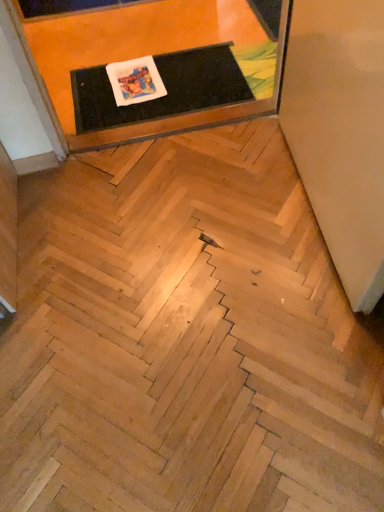
The width and height of the screenshot is (384, 512). Describe the element at coordinates (151, 121) in the screenshot. I see `matte black mat at upper center` at that location.

In order to click on matte black mat at upper center in this screenshot , I will do `click(151, 121)`.

Measure the distance between point (273, 95) and camera.

The depth of point (273, 95) is 5.57 feet.

Describe the element at coordinates (165, 87) in the screenshot. I see `black rubber mat at upper center` at that location.

Identify the location of black rubber mat at upper center. This screenshot has height=512, width=384. (165, 87).

This screenshot has width=384, height=512. Find the location of `matte black mat at upper center`. matte black mat at upper center is located at coordinates (151, 121).

Is black rubber mat at upper center to the left of matte black mat at upper center from the viewer's perspective?

In fact, black rubber mat at upper center is to the right of matte black mat at upper center.

Which object is further away from the camera, black rubber mat at upper center or matte black mat at upper center?

black rubber mat at upper center is further away from the camera.

Does point (99, 98) lie behind point (18, 47)?

Yes, it is.

From the image's perspective, is black rubber mat at upper center located above or below matte black mat at upper center?

black rubber mat at upper center is situated lower than matte black mat at upper center in the image.

From a real-world perspective, is black rubber mat at upper center located higher than matte black mat at upper center?

No, from a real-world perspective, black rubber mat at upper center is not over matte black mat at upper center

Is black rubber mat at upper center wider than matte black mat at upper center?

In fact, black rubber mat at upper center might be narrower than matte black mat at upper center.

Considering the relative sizes of black rubber mat at upper center and matte black mat at upper center in the image provided, is black rubber mat at upper center taller than matte black mat at upper center?

No, black rubber mat at upper center is not taller than matte black mat at upper center.

Is black rubber mat at upper center bigger or smaller than matte black mat at upper center?

Considering their sizes, black rubber mat at upper center takes up less space than matte black mat at upper center.

Would you say black rubber mat at upper center contains matte black mat at upper center?

No, matte black mat at upper center is not inside black rubber mat at upper center.

Are black rubber mat at upper center and matte black mat at upper center located far from each other?

No.

Is black rubber mat at upper center aimed at matte black mat at upper center?

Yes, black rubber mat at upper center is oriented towards matte black mat at upper center.

Image resolution: width=384 pixels, height=512 pixels. Identify the location of table below the matte black mat at upper center (from the image's perspective). (165, 87).

Can you confirm if matte black mat at upper center is positioned to the left of black rubber mat at upper center?

Yes.

Considering their positions, is matte black mat at upper center located in front of or behind black rubber mat at upper center?

Clearly, matte black mat at upper center is in front of black rubber mat at upper center.

Is point (40, 96) positioned in front of point (230, 64)?

Yes.

From the image's perspective, which one is positioned higher, matte black mat at upper center or black rubber mat at upper center?

matte black mat at upper center appears higher in the image.

From a real-world perspective, is matte black mat at upper center located higher than black rubber mat at upper center?

Yes, from a real-world perspective, matte black mat at upper center is above black rubber mat at upper center.

Considering the relative sizes of matte black mat at upper center and black rubber mat at upper center in the image provided, is matte black mat at upper center thinner than black rubber mat at upper center?

No, matte black mat at upper center is not thinner than black rubber mat at upper center.

Looking at this image, which of these two, matte black mat at upper center or black rubber mat at upper center, stands shorter?

black rubber mat at upper center is shorter.

Who is smaller, matte black mat at upper center or black rubber mat at upper center?

With smaller size is black rubber mat at upper center.

Is black rubber mat at upper center completely or partially inside matte black mat at upper center?

Yes, matte black mat at upper center is surrounding black rubber mat at upper center.

Are matte black mat at upper center and black rubber mat at upper center making contact?

No, matte black mat at upper center is not touching black rubber mat at upper center.

Could you tell me if matte black mat at upper center is turned towards black rubber mat at upper center?

Yes, matte black mat at upper center faces towards black rubber mat at upper center.

Looking at this image, how different are the orientations of matte black mat at upper center and black rubber mat at upper center in degrees?

The angle between the facing direction of matte black mat at upper center and the facing direction of black rubber mat at upper center is 1.68 degrees.

How much distance is there between matte black mat at upper center and black rubber mat at upper center?

matte black mat at upper center and black rubber mat at upper center are 6.71 inches apart.

Where is `furniture in front of the black rubber mat at upper center`? The image size is (384, 512). furniture in front of the black rubber mat at upper center is located at coordinates (151, 121).

Where is `furniture above the black rubber mat at upper center (from a real-world perspective)`? The image size is (384, 512). furniture above the black rubber mat at upper center (from a real-world perspective) is located at coordinates (151, 121).

In the image, there is a matte black mat at upper center. In order to click on table below it (from the image's perspective) in this screenshot , I will do `click(165, 87)`.